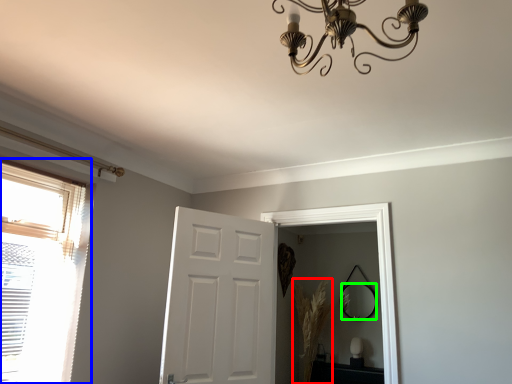
Question: Which is nearer to the plant (highlighted by a red box)? window (highlighted by a blue box) or mirror (highlighted by a green box).

Choices:
 (A) window
 (B) mirror

Answer: (B)